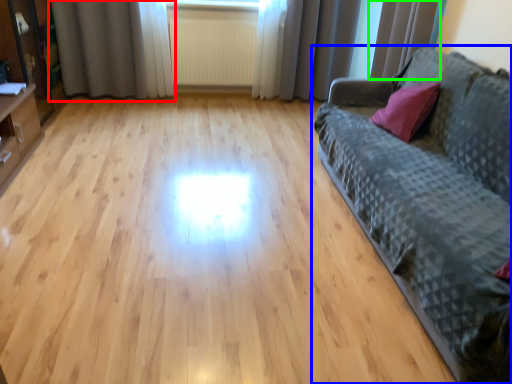
Question: Estimate the real-world distances between objects in this image. Which object is farther from curtain (highlighted by a red box), studio couch (highlighted by a blue box) or curtain (highlighted by a green box)?

Choices:
 (A) studio couch
 (B) curtain

Answer: (A)